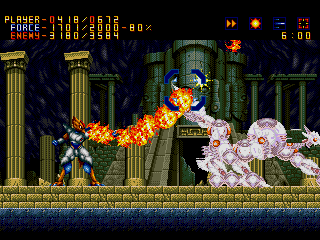
What are the coordinates of `pillar` in the screenshot? It's located at (12, 104), (69, 92), (40, 153), (110, 108), (126, 161), (257, 106), (283, 102), (302, 112), (161, 65).